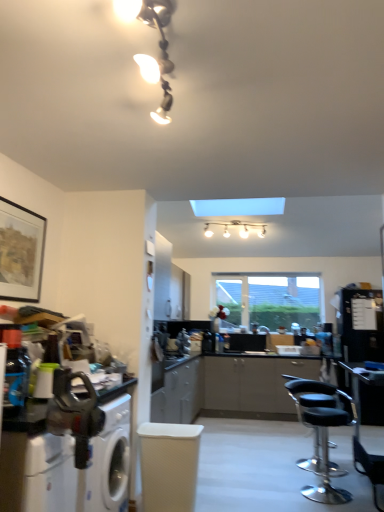
Question: From a real-world perspective, is white textured swivel chair at center located higher than metallic glass light fixture at upper center?

Choices:
 (A) yes
 (B) no

Answer: (B)

Question: Does white textured swivel chair at center come in front of metallic glass light fixture at upper center?

Choices:
 (A) yes
 (B) no

Answer: (B)

Question: Is white textured swivel chair at center oriented towards metallic glass light fixture at upper center?

Choices:
 (A) yes
 (B) no

Answer: (B)

Question: Does white textured swivel chair at center appear on the right side of metallic glass light fixture at upper center?

Choices:
 (A) no
 (B) yes

Answer: (A)

Question: Is white textured swivel chair at center thinner than metallic glass light fixture at upper center?

Choices:
 (A) no
 (B) yes

Answer: (B)

Question: From the image's perspective, relative to white glossy light fixture at upper center, is metallic silver countertop at lower left above or below?

Choices:
 (A) above
 (B) below

Answer: (B)

Question: In the image, is metallic silver countertop at lower left on the left side or the right side of white glossy light fixture at upper center?

Choices:
 (A) left
 (B) right

Answer: (A)

Question: Is metallic silver countertop at lower left inside or outside of white glossy light fixture at upper center?

Choices:
 (A) outside
 (B) inside

Answer: (A)

Question: Considering the positions of metallic silver countertop at lower left and white glossy light fixture at upper center in the image, is metallic silver countertop at lower left bigger or smaller than white glossy light fixture at upper center?

Choices:
 (A) big
 (B) small

Answer: (A)

Question: Is point (43, 455) positioned closer to the camera than point (190, 498)?

Choices:
 (A) farther
 (B) closer

Answer: (B)

Question: Considering the relative positions of metallic silver countertop at lower left and white textured swivel chair at center in the image provided, is metallic silver countertop at lower left to the left or to the right of white textured swivel chair at center?

Choices:
 (A) left
 (B) right

Answer: (A)

Question: Is metallic silver countertop at lower left taller or shorter than white textured swivel chair at center?

Choices:
 (A) short
 (B) tall

Answer: (B)

Question: Relative to white textured swivel chair at center, is metallic silver countertop at lower left in front or behind?

Choices:
 (A) front
 (B) behind

Answer: (A)

Question: Considering the positions of white glossy light fixture at upper center and transparent glass window at center in the image, is white glossy light fixture at upper center taller or shorter than transparent glass window at center?

Choices:
 (A) tall
 (B) short

Answer: (B)

Question: Is point (253, 226) positioned closer to the camera than point (281, 307)?

Choices:
 (A) closer
 (B) farther

Answer: (A)